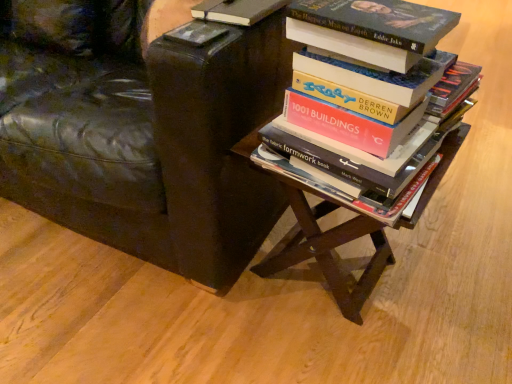
Describe the element at coordinates (384, 128) in the screenshot. I see `hardcover book at center, the first book from the bottom` at that location.

Locate an element on the screen. The image size is (512, 384). hardcover book at upper left, which is the 1th book in top-to-bottom order is located at coordinates (x=237, y=10).

Measure the distance between wooden table at center and camera.

A distance of 28.22 inches exists between wooden table at center and camera.

Locate an element on the screen. hardcover book at center, the second book in the top-to-bottom sequence is located at coordinates (384, 128).

Considering the relative sizes of wooden table at center and black leather chair at upper left in the image provided, is wooden table at center thinner than black leather chair at upper left?

Indeed, wooden table at center has a lesser width compared to black leather chair at upper left.

From the image's perspective, is wooden table at center located above or below black leather chair at upper left?

wooden table at center is situated lower than black leather chair at upper left in the image.

Who is smaller, wooden table at center or black leather chair at upper left?

wooden table at center.

Is wooden table at center surrounding black leather chair at upper left?

No, black leather chair at upper left is located outside of wooden table at center.

Choose the correct answer: Is hardcover book at upper left, acting as the second book starting from the bottom, inside black leather chair at upper left or outside it?

hardcover book at upper left, acting as the second book starting from the bottom, fits inside black leather chair at upper left.

From a real-world perspective, which is physically below, hardcover book at upper left, acting as the second book starting from the bottom, or black leather chair at upper left?

black leather chair at upper left.

From the picture: Between hardcover book at upper left, acting as the second book starting from the bottom, and black leather chair at upper left, which one appears on the left side from the viewer's perspective?

Positioned to the left is black leather chair at upper left.

Which point is more distant from viewer, (229, 4) or (139, 209)?

Positioned behind is point (139, 209).

Is black leather chair at upper left oriented away from hardcover book at upper left, which is the 1th book in top-to-bottom order?

No, black leather chair at upper left is not facing away from hardcover book at upper left, which is the 1th book in top-to-bottom order.

Which is behind, point (211, 282) or point (254, 7)?

Point (211, 282)

Can you confirm if black leather chair at upper left is thinner than hardcover book at upper left, acting as the second book starting from the bottom?

No, black leather chair at upper left is not thinner than hardcover book at upper left, acting as the second book starting from the bottom.

Would you say black leather chair at upper left is outside hardcover book at upper left, which is the 1th book in top-to-bottom order?

Indeed, black leather chair at upper left is completely outside hardcover book at upper left, which is the 1th book in top-to-bottom order.

Does point (284, 240) come closer to viewer compared to point (289, 101)?

No.

Is wooden table at center oriented towards hardcover book at center, the first book from the bottom?

No, wooden table at center is not aimed at hardcover book at center, the first book from the bottom.

Which is more to the left, wooden table at center or hardcover book at center, the second book in the top-to-bottom sequence?

hardcover book at center, the second book in the top-to-bottom sequence.

Who is more distant, hardcover book at upper left, which is the 1th book in top-to-bottom order, or hardcover book at center, the first book from the bottom?

hardcover book at upper left, which is the 1th book in top-to-bottom order.

From a real-world perspective, relative to hardcover book at center, the second book in the top-to-bottom sequence, is hardcover book at upper left, which is the 1th book in top-to-bottom order, vertically above or below?

In terms of real-world spatial position, hardcover book at upper left, which is the 1th book in top-to-bottom order, is above hardcover book at center, the second book in the top-to-bottom sequence.

Does point (243, 16) lie behind point (399, 98)?

That is True.

Considering the sizes of objects hardcover book at upper left, which is the 1th book in top-to-bottom order, and hardcover book at center, the second book in the top-to-bottom sequence, in the image provided, who is taller, hardcover book at upper left, which is the 1th book in top-to-bottom order, or hardcover book at center, the second book in the top-to-bottom sequence,?

hardcover book at center, the second book in the top-to-bottom sequence.

Is wooden table at center in front of or behind hardcover book at upper left, which is the 1th book in top-to-bottom order, in the image?

wooden table at center is positioned closer to the viewer than hardcover book at upper left, which is the 1th book in top-to-bottom order.

Who is smaller, wooden table at center or hardcover book at upper left, which is the 1th book in top-to-bottom order?

hardcover book at upper left, which is the 1th book in top-to-bottom order, is smaller.

Is wooden table at center outside of hardcover book at upper left, which is the 1th book in top-to-bottom order?

Indeed, wooden table at center is completely outside hardcover book at upper left, which is the 1th book in top-to-bottom order.

Based on the photo, is wooden table at center facing towards hardcover book at upper left, acting as the second book starting from the bottom?

No, wooden table at center does not turn towards hardcover book at upper left, acting as the second book starting from the bottom.

Who is taller, hardcover book at upper left, acting as the second book starting from the bottom, or wooden table at center?

Standing taller between the two is wooden table at center.

Could you tell me if hardcover book at upper left, acting as the second book starting from the bottom, is facing wooden table at center?

No, hardcover book at upper left, acting as the second book starting from the bottom, is not oriented towards wooden table at center.

From a real-world perspective, is hardcover book at upper left, which is the 1th book in top-to-bottom order, above or below wooden table at center?

From a real-world perspective, hardcover book at upper left, which is the 1th book in top-to-bottom order, is physically above wooden table at center.

From the image's perspective, between hardcover book at upper left, which is the 1th book in top-to-bottom order, and wooden table at center, which one is located above?

hardcover book at upper left, which is the 1th book in top-to-bottom order, is shown above in the image.

The height and width of the screenshot is (384, 512). In the image, there is a black leather chair at upper left. Identify the location of table below it (from the image's perspective). (339, 225).

From the black leather chair at upper left, count 1st book to the right and point to it. Please provide its 2D coordinates.

[(237, 10)]

Looking at the image, which one is located closer to wooden table at center, hardcover book at upper left, which is the 1th book in top-to-bottom order, or black leather chair at upper left?

black leather chair at upper left.

Estimate the real-world distances between objects in this image. Which object is further from hardcover book at upper left, acting as the second book starting from the bottom, wooden table at center or hardcover book at center, the first book from the bottom?

wooden table at center is positioned further to the anchor hardcover book at upper left, acting as the second book starting from the bottom.

Estimate the real-world distances between objects in this image. Which object is further from black leather chair at upper left, hardcover book at center, the second book in the top-to-bottom sequence, or hardcover book at upper left, acting as the second book starting from the bottom?

The object further to black leather chair at upper left is hardcover book at upper left, acting as the second book starting from the bottom.

Which object lies nearer to the anchor point wooden table at center, black leather chair at upper left or hardcover book at center, the second book in the top-to-bottom sequence?

The object closer to wooden table at center is hardcover book at center, the second book in the top-to-bottom sequence.

Consider the image. Considering their positions, is hardcover book at upper left, acting as the second book starting from the bottom, positioned closer to hardcover book at center, the first book from the bottom, than black leather chair at upper left?

hardcover book at upper left, acting as the second book starting from the bottom, is closer to hardcover book at center, the first book from the bottom.

Estimate the real-world distances between objects in this image. Which object is closer to wooden table at center, hardcover book at center, the second book in the top-to-bottom sequence, or black leather chair at upper left?

hardcover book at center, the second book in the top-to-bottom sequence, is positioned closer to the anchor wooden table at center.

Considering their positions, is wooden table at center positioned closer to black leather chair at upper left than hardcover book at center, the second book in the top-to-bottom sequence?

Among the two, wooden table at center is located nearer to black leather chair at upper left.

When comparing their distances from hardcover book at upper left, which is the 1th book in top-to-bottom order, does hardcover book at center, the second book in the top-to-bottom sequence, or wooden table at center seem closer?

hardcover book at center, the second book in the top-to-bottom sequence, is positioned closer to the anchor hardcover book at upper left, which is the 1th book in top-to-bottom order.

Where is `book between hardcover book at upper left, acting as the second book starting from the bottom, and wooden table at center from top to bottom`? book between hardcover book at upper left, acting as the second book starting from the bottom, and wooden table at center from top to bottom is located at coordinates click(384, 128).

At what (x,y) coordinates should I click in order to perform the action: click on book between black leather chair at upper left and hardcover book at center, the second book in the top-to-bottom sequence. Please return your answer as a coordinate pair (x, y). Looking at the image, I should click on (237, 10).